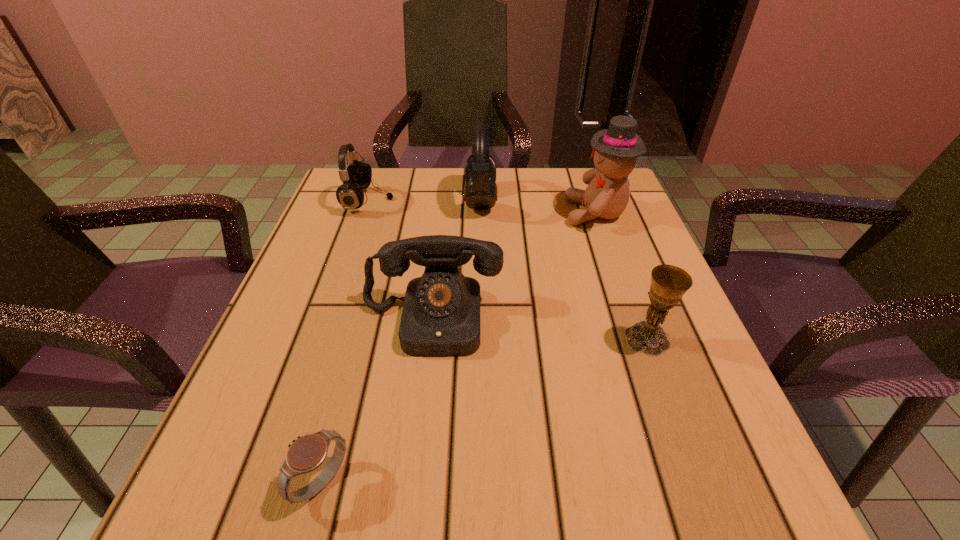
Image resolution: width=960 pixels, height=540 pixels. Find the location of `vacant space situated on the front-facing side of the rag_doll`. vacant space situated on the front-facing side of the rag_doll is located at coordinates point(501,213).

Locate an element on the screen. The width and height of the screenshot is (960, 540). vacant space positioned 0.210m on the earcups of the taller headset is located at coordinates (379, 200).

Where is `vacant space situated 0.180m on the earcups of the taller headset`? The image size is (960, 540). vacant space situated 0.180m on the earcups of the taller headset is located at coordinates (391, 200).

The image size is (960, 540). I want to click on blank area located 0.140m on the earcups of the taller headset, so click(407, 200).

This screenshot has height=540, width=960. In order to click on free point located on the dial of the telephone in this screenshot , I will do `click(418, 450)`.

At what (x,y) coordinates should I click in order to perform the action: click on free space located with the microphone on the side of the left headset. Please return your answer as a coordinate pair (x, y). This screenshot has height=540, width=960. Looking at the image, I should click on (475, 201).

At what (x,y) coordinates should I click in order to perform the action: click on free space located on the left of the chalice. Please return your answer as a coordinate pair (x, y). Looking at the image, I should click on (444, 339).

This screenshot has height=540, width=960. Identify the location of free space located on the back of the shortest object. (348, 384).

This screenshot has height=540, width=960. In order to click on rag_doll present at the far edge in this screenshot , I will do [615, 150].

The height and width of the screenshot is (540, 960). Find the location of `object at the near edge`. object at the near edge is located at coordinates (307, 453).